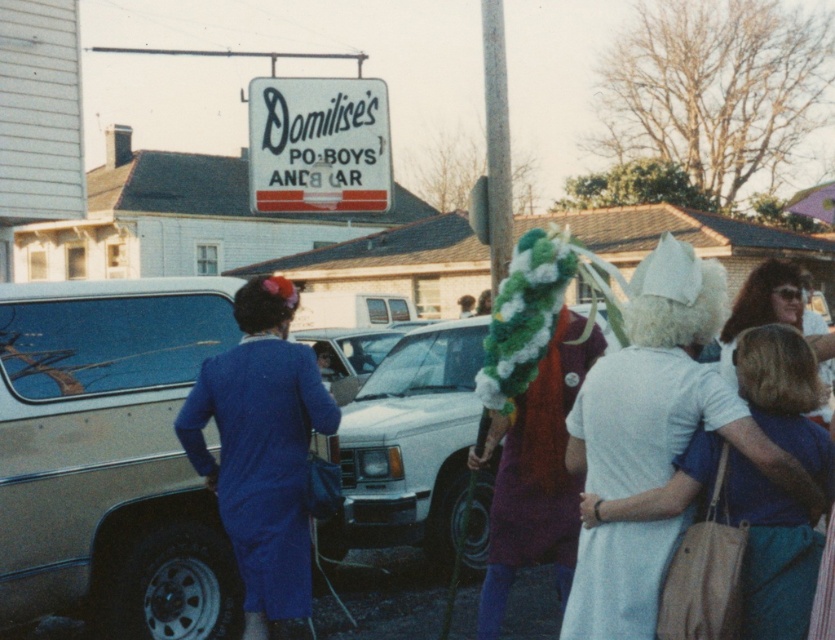
You are a photographer trying to capture a group photo of the matte gold minivan at left and the matte blue dress at left. Since you want both subjects to appear balanced in the frame, which object should you move closer to the camera to achieve this?

The matte blue dress at left should be moved closer to the camera because it is smaller in size compared to the matte gold minivan at left, so bringing it nearer will help balance their sizes in the photo.

Based on the scene description, can you determine the spatial relationship between the matte blue dress at left and the white cotton dress at center in terms of their vertical positioning?

The matte blue dress at left is below the white cotton dress at center, meaning the white cotton dress at center is positioned higher up vertically compared to the matte blue dress at left.

You are a photographer at the scene and want to capture the matte gold minivan at left and the matte blue dress at left in the same frame. Which object should be placed closer to the camera to ensure both are visible?

The matte blue dress at left should be placed closer to the camera because the matte gold minivan at left is positioned over it, meaning the minivan is further away. By moving the dress forward, both will be in the same plane and visible.